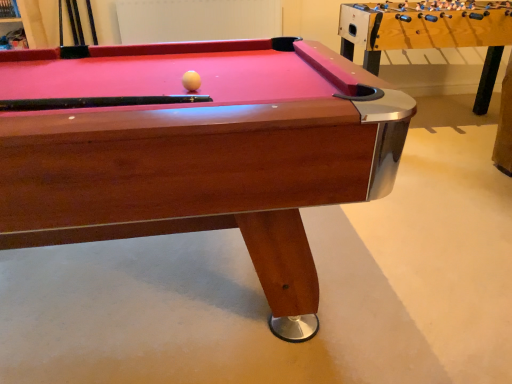
You are a GUI agent. You are given a task and a screenshot of the screen. Output one action in this format:
    pyautogui.click(x=<x>, y=<y>)
    Task: Click on the free space below wooden billiard table at center (from a real-world perspective)
    This screenshot has height=384, width=512.
    Given the screenshot: What is the action you would take?
    [129, 296]